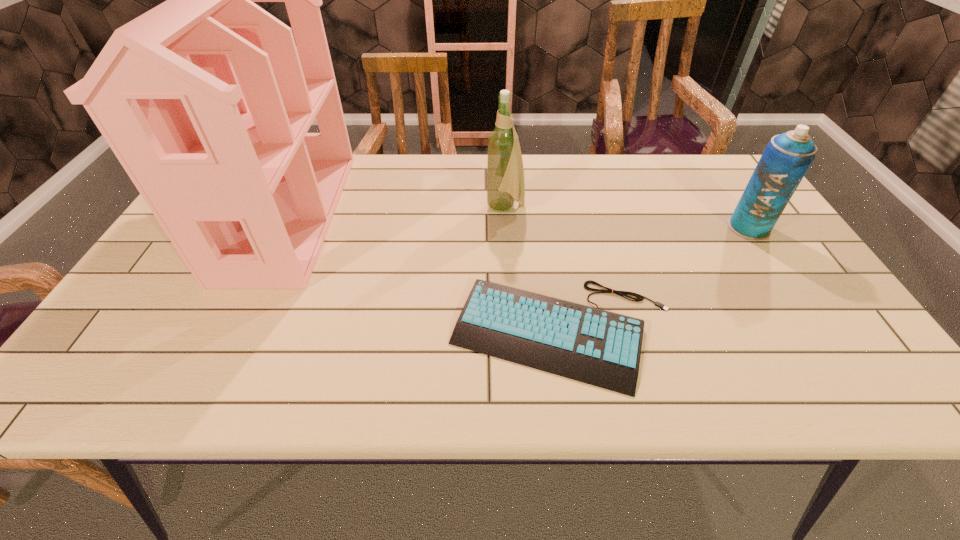
Where is `dollhouse`? dollhouse is located at coordinates (206, 101).

This screenshot has height=540, width=960. I want to click on the tallest object, so point(206,101).

This screenshot has width=960, height=540. I want to click on wine bottle, so click(x=505, y=173).

The image size is (960, 540). I want to click on the rightmost object, so click(787, 157).

Identify the location of the second shortest object. The image size is (960, 540). (787, 157).

Find the location of `computer keyboard`. computer keyboard is located at coordinates (597, 347).

Find the location of `free location located on the front-facing side of the tallest object`. free location located on the front-facing side of the tallest object is located at coordinates (446, 215).

What are the coordinates of `vacant space located 0.150m on the front-facing side of the wine bottle` in the screenshot? It's located at (433, 208).

The height and width of the screenshot is (540, 960). In order to click on vacant space located 0.050m on the front-facing side of the wine bottle in this screenshot , I will do `click(468, 208)`.

In order to click on vacant space situated 0.320m on the front-facing side of the wine bottle in this screenshot , I will do `click(372, 208)`.